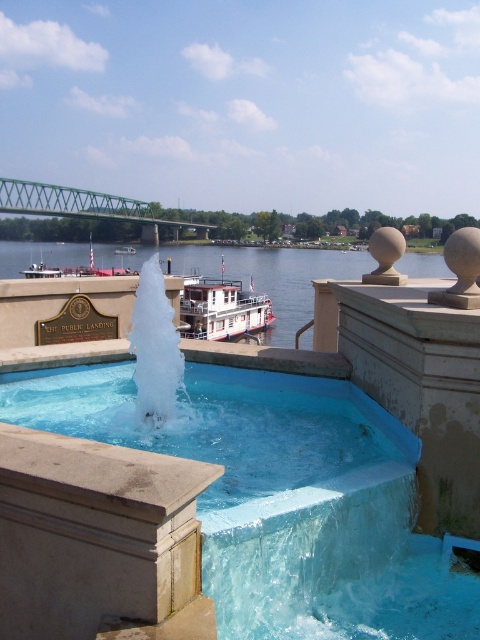
Question: Estimate the real-world distances between objects in this image. Which object is closer to the blue water at center?

Choices:
 (A) green metallic bridge at upper left
 (B) blue glossy fountain at center

Answer: (A)

Question: In this image, where is blue glossy fountain at center located relative to blue water at center?

Choices:
 (A) below
 (B) above

Answer: (A)

Question: Which of the following is the closest to the observer?

Choices:
 (A) (81, 208)
 (B) (299, 444)

Answer: (B)

Question: Estimate the real-world distances between objects in this image. Which object is farther from the green metallic bridge at upper left?

Choices:
 (A) blue glossy fountain at center
 (B) blue water at center

Answer: (A)

Question: Does blue glossy fountain at center appear on the right side of green metallic bridge at upper left?

Choices:
 (A) no
 (B) yes

Answer: (B)

Question: Is blue water at center to the right of green metallic bridge at upper left from the viewer's perspective?

Choices:
 (A) no
 (B) yes

Answer: (B)